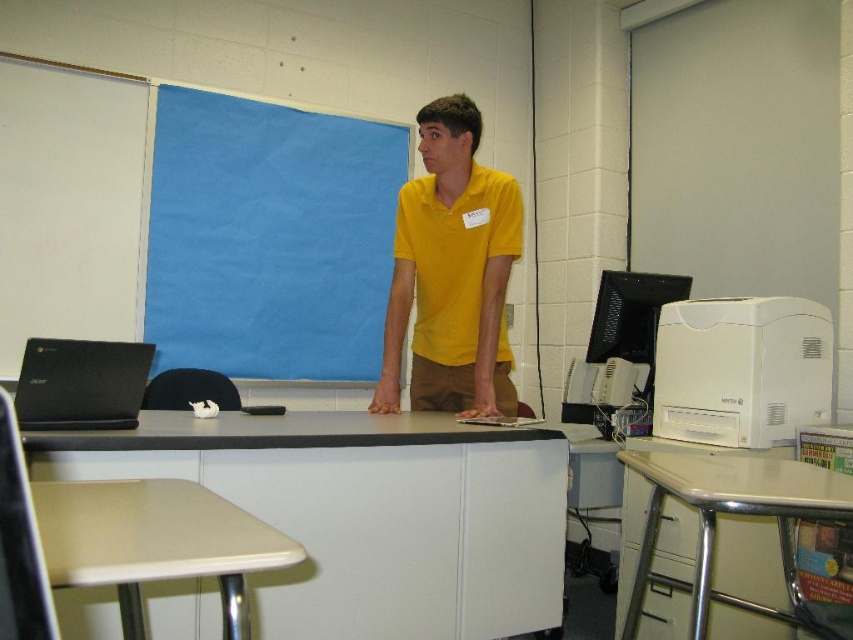
You are organizing a classroom and need to place a new 18x18 inch poster. The metallic beige table at lower right and the black matte laptop at left are on the desk. Which object can accommodate the poster without overlapping?

The metallic beige table at lower right has a larger size compared to the black matte laptop at left, so it can accommodate the poster without overlapping.

You are a student who needs to place a textbook on the white plastic table at center and the black matte laptop at left. Which surface can accommodate the textbook without it hanging off the edge?

The white plastic table at center is bigger than the black matte laptop at left, so the textbook can be placed on the white plastic table at center without hanging off the edge.